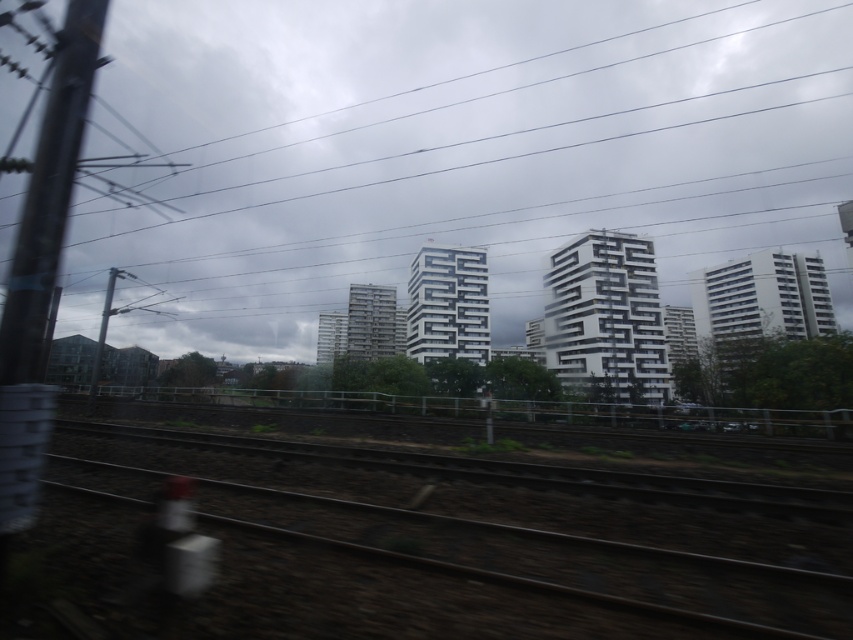
Who is positioned more to the left, white matte building at center or brown dirt at bottom?

Positioned to the left is brown dirt at bottom.

Consider the image. Is white matte building at center further to the viewer compared to brown dirt at bottom?

Yes, it is behind brown dirt at bottom.

Between point (705, 64) and point (259, 515), which one is positioned behind?

Point (705, 64)

Where is `white matte building at center`? white matte building at center is located at coordinates (456, 150).